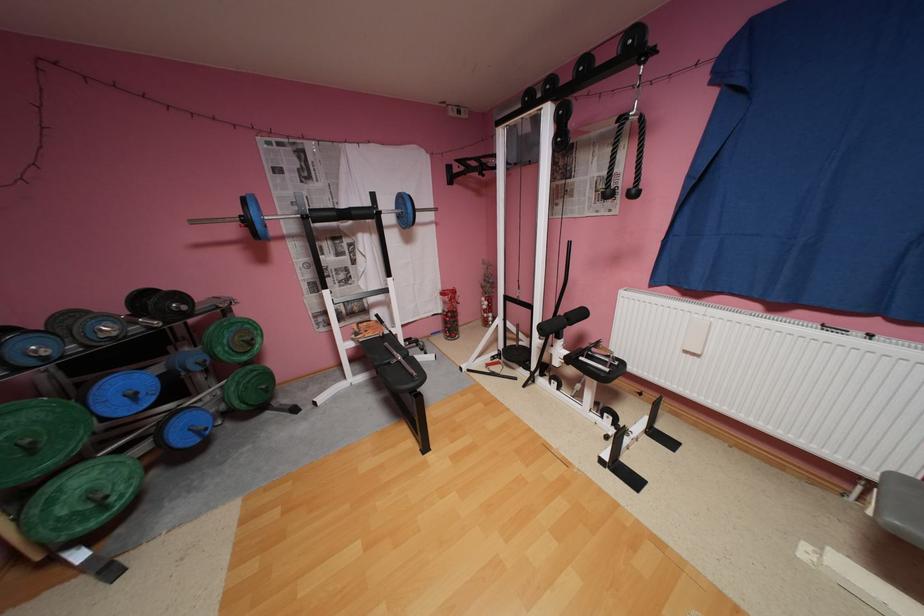
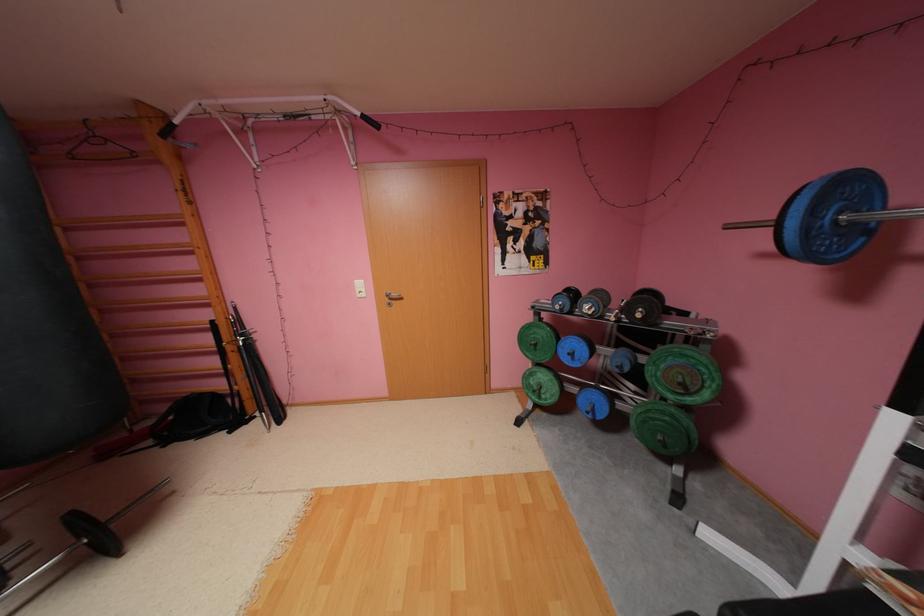
The point at (142,395) is marked in the first image. Where is the corresponding point in the second image?

(580, 354)